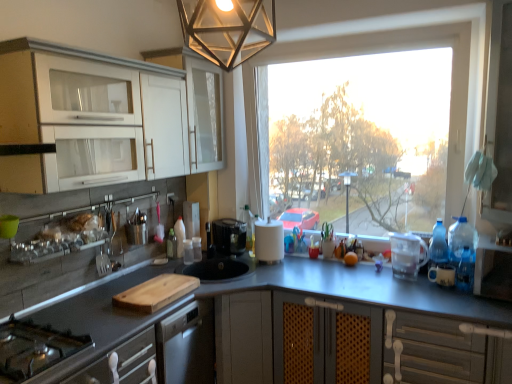
Describe the element at coordinates (269, 241) in the screenshot. I see `white matte paper towel at center` at that location.

In order to click on blue plastic cup at right, the 2th appliance when ordered from right to left in this screenshot , I will do `click(442, 275)`.

What do you see at coordinates (365, 290) in the screenshot?
I see `smooth gray countertop at center` at bounding box center [365, 290].

Locate an element on the screen. The image size is (512, 384). black glass gas stove at lower left is located at coordinates 34,349.

Is wooden cutting board at center not near blue plastic water bottles at right, placed as the 3th appliance when sorted from left to right?

wooden cutting board at center is far away from blue plastic water bottles at right, placed as the 3th appliance when sorted from left to right.

From a real-world perspective, is wooden cutting board at center over blue plastic water bottles at right, placed as the 3th appliance when sorted from left to right?

Actually, wooden cutting board at center is physically below blue plastic water bottles at right, placed as the 3th appliance when sorted from left to right, in the real world.

Which of these two, wooden cutting board at center or blue plastic water bottles at right, which appears as the first appliance when viewed from the right, stands taller?

Standing taller between the two is blue plastic water bottles at right, which appears as the first appliance when viewed from the right.

Is metallic geometric light fixture at upper center looking in the opposite direction of white glossy cabinet at upper left, which is the 2th cabinetry from back to front?

No, metallic geometric light fixture at upper center is not facing the opposite direction of white glossy cabinet at upper left, which is the 2th cabinetry from back to front.

Considering the sizes of objects metallic geometric light fixture at upper center and white glossy cabinet at upper left, which is counted as the first cabinetry, starting from the front, in the image provided, who is wider, metallic geometric light fixture at upper center or white glossy cabinet at upper left, which is counted as the first cabinetry, starting from the front,?

With larger width is white glossy cabinet at upper left, which is counted as the first cabinetry, starting from the front.

Does point (209, 57) come behind point (191, 162)?

No, (209, 57) is in front of (191, 162).

Who is taller, metallic geometric light fixture at upper center or white glossy cabinet at upper left, which is the 2th cabinetry from back to front?

Standing taller between the two is white glossy cabinet at upper left, which is the 2th cabinetry from back to front.

Looking at the image, does transparent glass window at center seem bigger or smaller compared to white matte paper towel at center?

In the image, transparent glass window at center appears to be larger than white matte paper towel at center.

Considering the positions of point (470, 89) and point (261, 226), is point (470, 89) closer or farther from the camera than point (261, 226)?

Point (470, 89).

Considering the sizes of objects transparent glass window at center and white matte paper towel at center in the image provided, who is thinner, transparent glass window at center or white matte paper towel at center?

white matte paper towel at center is thinner.

Which is more to the right, transparent glass window at center or white matte paper towel at center?

Positioned to the right is transparent glass window at center.

Can you confirm if white plastic screen door at right is shorter than black glass gas stove at lower left?

Incorrect, the height of white plastic screen door at right does not fall short of that of black glass gas stove at lower left.

Based on the photo, which object is positioned more to the right, white plastic screen door at right or black glass gas stove at lower left?

white plastic screen door at right is more to the right.

Is white plastic screen door at right looking in the opposite direction of black glass gas stove at lower left?

No, white plastic screen door at right is not facing the opposite direction of black glass gas stove at lower left.

Which object is more forward, white matte paper towel at center or blue plastic cup at right, the 2th appliance when ordered from right to left?

Positioned in front is blue plastic cup at right, the 2th appliance when ordered from right to left.

From a real-world perspective, is white matte paper towel at center positioned under blue plastic cup at right, which is counted as the second appliance, starting from the left, based on gravity?

Actually, white matte paper towel at center is physically above blue plastic cup at right, which is counted as the second appliance, starting from the left, in the real world.

Does point (263, 255) lie behind point (437, 279)?

Yes, it is behind point (437, 279).

Which of these two, white matte paper towel at center or blue plastic cup at right, which is counted as the second appliance, starting from the left, stands shorter?

With less height is blue plastic cup at right, which is counted as the second appliance, starting from the left.

Is black plastic coffee machine at center inside the boundaries of white plastic screen door at right, or outside?

black plastic coffee machine at center is outside white plastic screen door at right.

Can you see black plastic coffee machine at center touching white plastic screen door at right?

They are not placed beside each other.

Can you tell me how much black plastic coffee machine at center and white plastic screen door at right differ in facing direction?

89.3 degrees separate the facing orientations of black plastic coffee machine at center and white plastic screen door at right.

Consider the image. Could you tell me if black plastic coffee machine at center is turned towards white plastic screen door at right?

No, black plastic coffee machine at center is not aimed at white plastic screen door at right.

Which object is further away from the camera taking this photo, smooth gray countertop at center or metallic geometric light fixture at upper center?

smooth gray countertop at center is further from the camera.

Who is taller, smooth gray countertop at center or metallic geometric light fixture at upper center?

smooth gray countertop at center.

Is smooth gray countertop at center located outside metallic geometric light fixture at upper center?

Absolutely, smooth gray countertop at center is external to metallic geometric light fixture at upper center.

Is smooth gray countertop at center with metallic geometric light fixture at upper center?

They are not placed beside each other.

From the image's perspective, count 3rd appliances upward from the wooden cutting board at center and point to it. Please provide its 2D coordinates.

[(462, 240)]

What are the coordinates of `cabinetry located below the metallic geometric light fixture at upper center (from the image's perspective)` in the screenshot? It's located at (104, 118).

Looking at this image, looking at the image, which one is located further to blue plastic bottle at right, marked as the 2th bottle in a front-to-back arrangement, blue plastic cup at right, which is counted as the second appliance, starting from the left, or white matte paper towel at center?

white matte paper towel at center is positioned further to the anchor blue plastic bottle at right, marked as the 2th bottle in a front-to-back arrangement.

Estimate the real-world distances between objects in this image. Which object is closer to blue plastic cup at right, the 2th appliance when ordered from right to left, black plastic coffee machine at center or translucent plastic bottle at center, the 4th bottle positioned from the right?

The object closer to blue plastic cup at right, the 2th appliance when ordered from right to left, is black plastic coffee machine at center.

From the image, which object appears to be nearer to satin silver cutlery at left, blue plastic bottle at right, the 3th bottle when ordered from left to right, or transparent glass window at center?

transparent glass window at center lies closer to satin silver cutlery at left than the other object.

From the image, which object appears to be nearer to orange matte at counter, blue plastic water bottles at right, placed as the 3th appliance when sorted from left to right, or transparent glass window at center?

The object closer to orange matte at counter is blue plastic water bottles at right, placed as the 3th appliance when sorted from left to right.

Based on their spatial positions, is transparent glass window at center or translucent plastic bottle at center, the 3th bottle when ordered from right to left, further from blue plastic cup at right, the 2th appliance when ordered from right to left?

translucent plastic bottle at center, the 3th bottle when ordered from right to left, is positioned further to the anchor blue plastic cup at right, the 2th appliance when ordered from right to left.

Looking at the image, which one is located closer to blue plastic bottle at right, the 3th bottle when ordered from left to right, black glass gas stove at lower left or smooth gray countertop at center?

Based on the image, smooth gray countertop at center appears to be nearer to blue plastic bottle at right, the 3th bottle when ordered from left to right.

Which object lies nearer to the anchor point satin silver cutlery at left, transparent glass window at center or white plastic screen door at right?

transparent glass window at center lies closer to satin silver cutlery at left than the other object.

Which object lies nearer to the anchor point translucent plastic bottle at center, which is counted as the 2th bottle, starting from the back, white matte paper towel at center or smooth gray countertop at center?

Among the two, white matte paper towel at center is located nearer to translucent plastic bottle at center, which is counted as the 2th bottle, starting from the back.

Where is `orange between smooth gray countertop at center and black plastic coffee machine at center along the z-axis`? The image size is (512, 384). orange between smooth gray countertop at center and black plastic coffee machine at center along the z-axis is located at coordinates (350, 259).

Where is `window located between white glossy cabinet at upper left, which is the 2th cabinetry from back to front, and orange matte at counter in the left-right direction`? The image size is (512, 384). window located between white glossy cabinet at upper left, which is the 2th cabinetry from back to front, and orange matte at counter in the left-right direction is located at coordinates (403, 50).

What are the coordinates of `bottle located between wooden cutting board at center and blue plastic bottle at right, which ranks as the 3th bottle in back-to-front order, in the left-right direction` in the screenshot? It's located at (249, 229).

Where is `paper towel located between black glass gas stove at lower left and blue translucent bottle at right, placed as the 4th bottle when sorted from left to right, in the left-right direction`? The height and width of the screenshot is (384, 512). paper towel located between black glass gas stove at lower left and blue translucent bottle at right, placed as the 4th bottle when sorted from left to right, in the left-right direction is located at coordinates (269, 241).